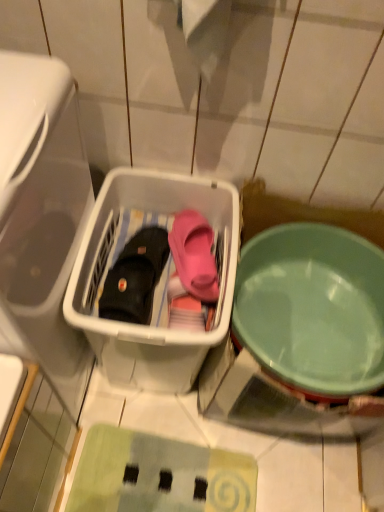
Question: Would you say transparent plastic basket at left is a long distance from light green plastic bowl at right?

Choices:
 (A) no
 (B) yes

Answer: (A)

Question: Is transparent plastic basket at left aimed at light green plastic bowl at right?

Choices:
 (A) yes
 (B) no

Answer: (A)

Question: Could light green plastic bowl at right be considered to be inside transparent plastic basket at left?

Choices:
 (A) no
 (B) yes

Answer: (A)

Question: Can you confirm if transparent plastic basket at left is positioned to the left of light green plastic bowl at right?

Choices:
 (A) yes
 (B) no

Answer: (A)

Question: From the image's perspective, does transparent plastic basket at left appear higher than light green plastic bowl at right?

Choices:
 (A) no
 (B) yes

Answer: (B)

Question: Is black leather boot at center spatially inside white plastic basket at center, or outside of it?

Choices:
 (A) inside
 (B) outside

Answer: (A)

Question: In terms of height, does black leather boot at center look taller or shorter compared to white plastic basket at center?

Choices:
 (A) tall
 (B) short

Answer: (B)

Question: Considering the positions of point (139, 287) and point (218, 306), is point (139, 287) closer or farther from the camera than point (218, 306)?

Choices:
 (A) closer
 (B) farther

Answer: (B)

Question: Looking at the image, does black leather boot at center seem bigger or smaller compared to white plastic basket at center?

Choices:
 (A) small
 (B) big

Answer: (A)

Question: Does point (279, 359) appear closer or farther from the camera than point (155, 257)?

Choices:
 (A) farther
 (B) closer

Answer: (B)

Question: From the image's perspective, is light green plastic bowl at right positioned above or below black leather boot at center?

Choices:
 (A) below
 (B) above

Answer: (A)

Question: Is light green plastic bowl at right bigger or smaller than black leather boot at center?

Choices:
 (A) small
 (B) big

Answer: (B)

Question: In terms of width, does light green plastic bowl at right look wider or thinner when compared to black leather boot at center?

Choices:
 (A) thin
 (B) wide

Answer: (B)

Question: From a real-world perspective, is transparent plastic basket at left above or below white plastic basket at center?

Choices:
 (A) above
 (B) below

Answer: (A)

Question: Is transparent plastic basket at left situated inside white plastic basket at center or outside?

Choices:
 (A) outside
 (B) inside

Answer: (A)